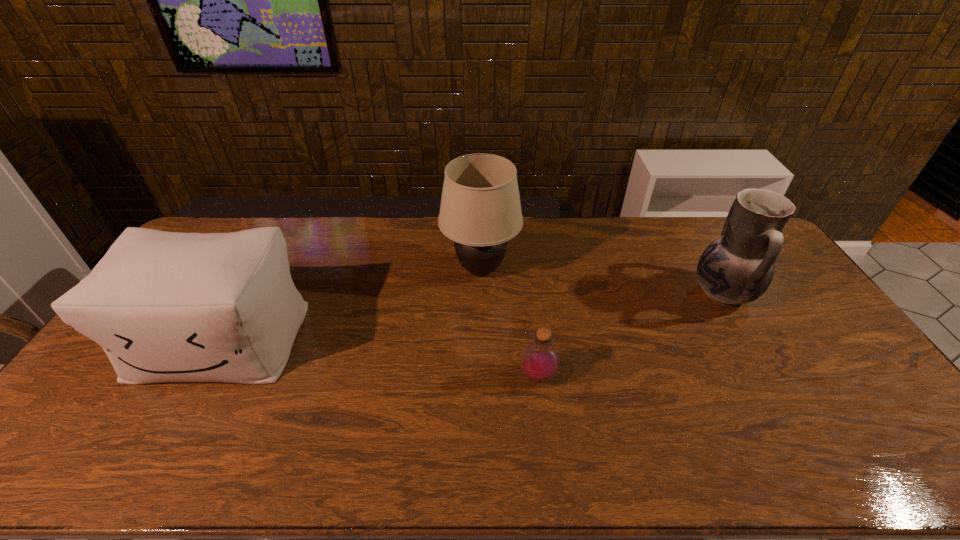
The image size is (960, 540). I want to click on free point that satisfies the following two spatial constraints: 1. on the side of the leftmost object with the smiley face; 2. on the right side of the shortest object, so click(201, 376).